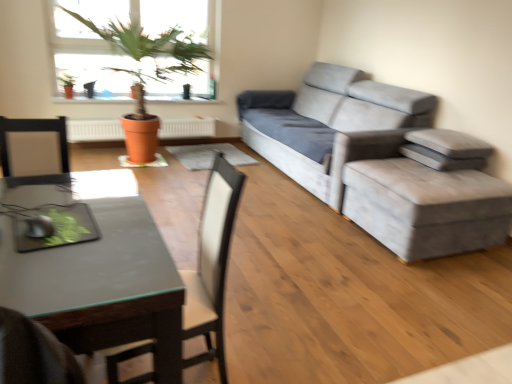
The width and height of the screenshot is (512, 384). Find the location of `free space between velvet grey stool at right and black glass desk at lower left`. free space between velvet grey stool at right and black glass desk at lower left is located at coordinates pyautogui.click(x=335, y=282).